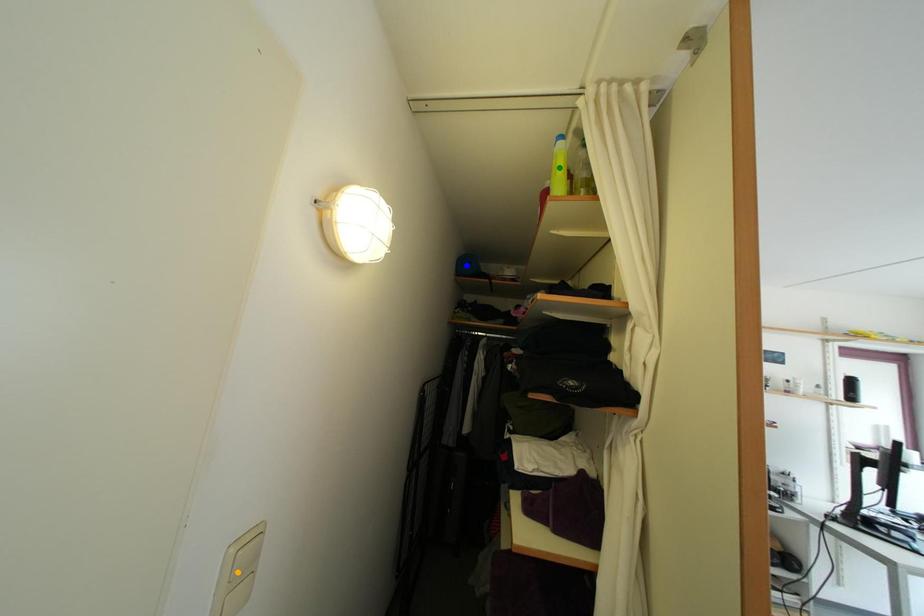
Order these from nearest to farthest:
A) blue point
B) green point
C) orange point

orange point, green point, blue point